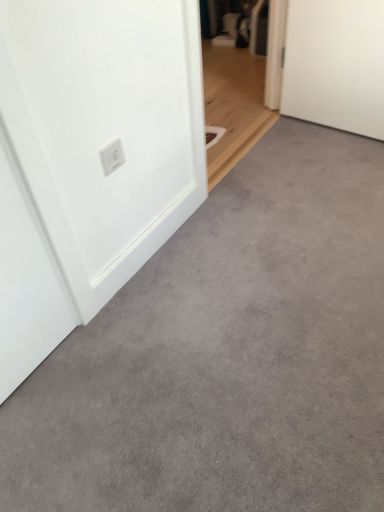
Locate an element on the screen. This screenshot has height=512, width=384. white plastic light switch at upper left is located at coordinates (112, 156).

The height and width of the screenshot is (512, 384). What do you see at coordinates (112, 156) in the screenshot?
I see `white plastic light switch at upper left` at bounding box center [112, 156].

Where is `white plastic light switch at upper left`? Image resolution: width=384 pixels, height=512 pixels. white plastic light switch at upper left is located at coordinates (112, 156).